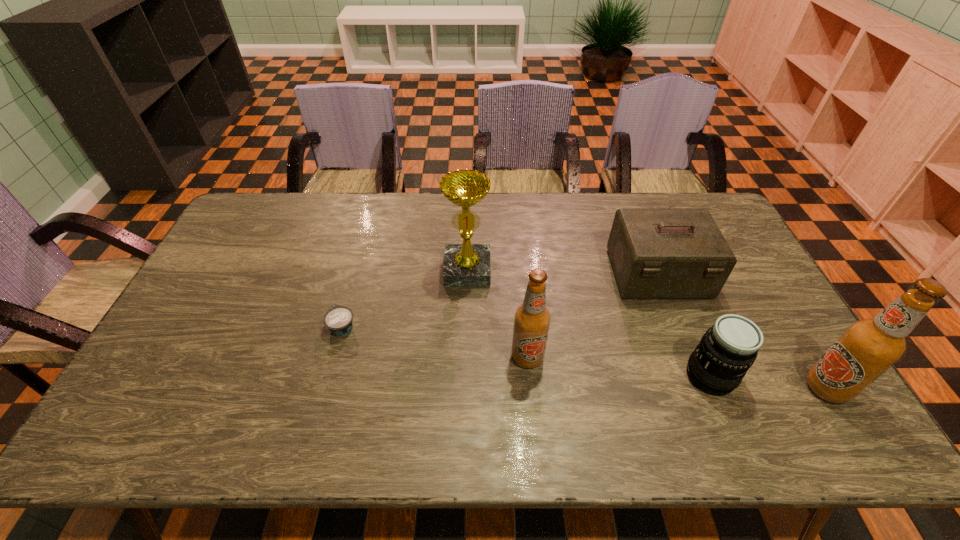
Please show where to add a beer bottle on the left while keeping spacing even. Please provide its 2D coordinates. Your answer should be formatted as a tuple, i.e. [(x, y)], where the tuple contains the x and y coordinates of a point satisfying the conditions above.

[(259, 329)]